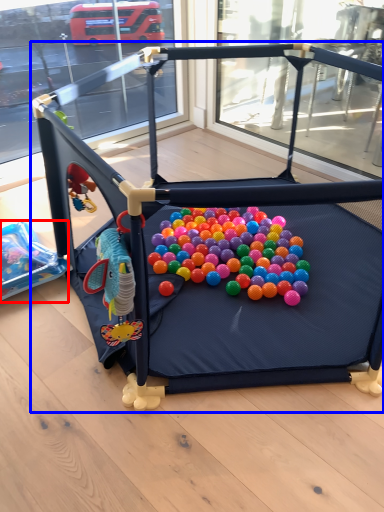
Question: Which object appears farthest to the camera in this image, toy (highlighted by a red box) or toy (highlighted by a blue box)?

Choices:
 (A) toy
 (B) toy

Answer: (A)